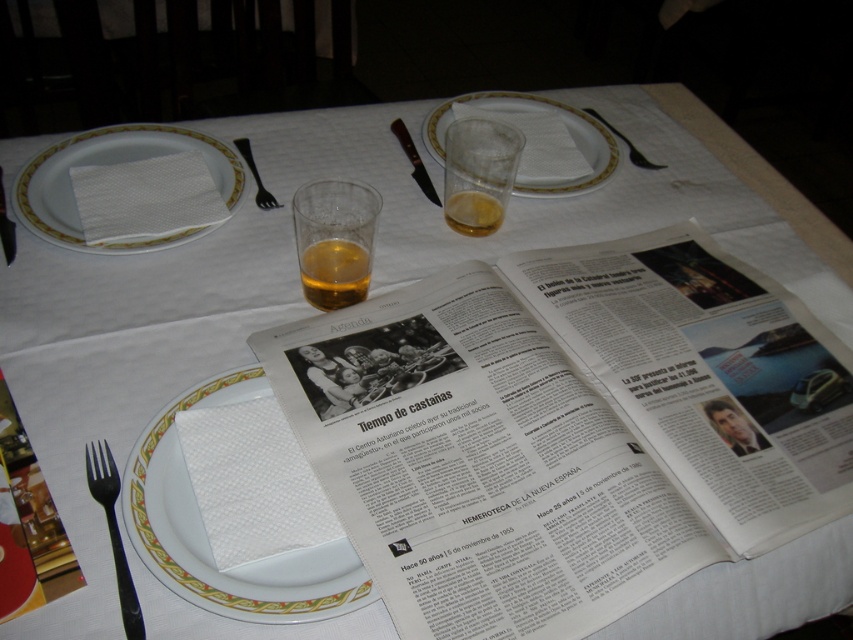
Between translucent glass at center and black plastic fork at lower left, which one appears on the right side from the viewer's perspective?

translucent glass at center is more to the right.

Is translucent glass at center to the left of black plastic fork at lower left from the viewer's perspective?

Incorrect, translucent glass at center is not on the left side of black plastic fork at lower left.

Where is `translucent glass at center`? This screenshot has height=640, width=853. translucent glass at center is located at coordinates (479, 173).

Identify the location of translucent glass at center. This screenshot has height=640, width=853. (479, 173).

Who is taller, amber glass at center or black plastic fork at upper left?

amber glass at center is taller.

Which is behind, point (363, 284) or point (247, 148)?

The point (247, 148) is behind.

Which is behind, point (370, 243) or point (260, 198)?

Point (260, 198)

The width and height of the screenshot is (853, 640). Find the location of `amber glass at center`. amber glass at center is located at coordinates (334, 241).

Is white glossy plate at center positioned at the back of translucent glass at center?

No, it is in front of translucent glass at center.

Between white glossy plate at center and translucent glass at center, which one appears on the right side from the viewer's perspective?

translucent glass at center is more to the right.

At what (x,y) coordinates should I click in order to perform the action: click on white glossy plate at center. Please return your answer as a coordinate pair (x, y). The image size is (853, 640). Looking at the image, I should click on (206, 536).